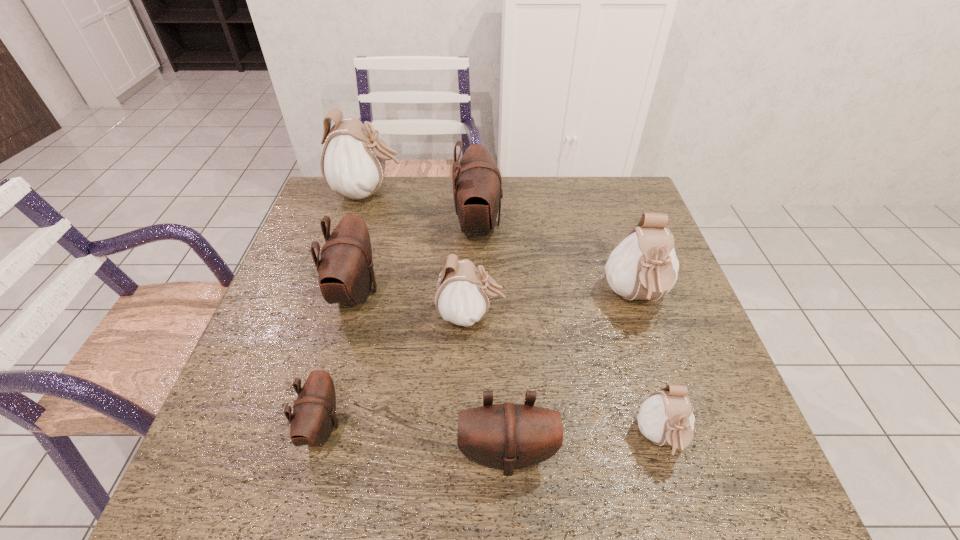
This screenshot has height=540, width=960. I want to click on vacant space that is in between the farthest brown pouch and the second biggest white pouch, so click(x=557, y=261).

Where is `empty location between the third white pouch from right to left and the smallest brown pouch`? The image size is (960, 540). empty location between the third white pouch from right to left and the smallest brown pouch is located at coordinates (396, 371).

This screenshot has height=540, width=960. Find the location of `object that stands as the fourth closest to the second smallest white pouch`. object that stands as the fourth closest to the second smallest white pouch is located at coordinates (314, 411).

You are a GUI agent. You are given a task and a screenshot of the screen. Output one action in this format:
    pyautogui.click(x=<x>, y=<y>)
    Task: Click on the object that is the nearest to the second smallest white pouch
    The image size is (960, 540).
    Given the screenshot: What is the action you would take?
    pyautogui.click(x=477, y=185)

Identify which pouch is located as the fourth nearest to the second white pouch from left to right. Please provide its 2D coordinates. Your answer should be formatted as a tuple, i.e. [(x, y)], where the tuple contains the x and y coordinates of a point satisfying the conditions above.

[(314, 411)]

Locate an element on the screen. The width and height of the screenshot is (960, 540). the sixth closest pouch relative to the smallest brown pouch is located at coordinates (644, 266).

Where is `white pouch that can be found as the third closest to the biggest white pouch`? This screenshot has height=540, width=960. white pouch that can be found as the third closest to the biggest white pouch is located at coordinates (666, 418).

Select which white pouch is the closest to the smallest white pouch. Please provide its 2D coordinates. Your answer should be formatted as a tuple, i.e. [(x, y)], where the tuple contains the x and y coordinates of a point satisfying the conditions above.

[(644, 266)]

The width and height of the screenshot is (960, 540). Find the location of `brown pouch that stands as the second closest to the smallest brown pouch`. brown pouch that stands as the second closest to the smallest brown pouch is located at coordinates (508, 436).

Identify which brown pouch is the second nearest to the second smallest white pouch. Please provide its 2D coordinates. Your answer should be formatted as a tuple, i.e. [(x, y)], where the tuple contains the x and y coordinates of a point satisfying the conditions above.

[(345, 270)]